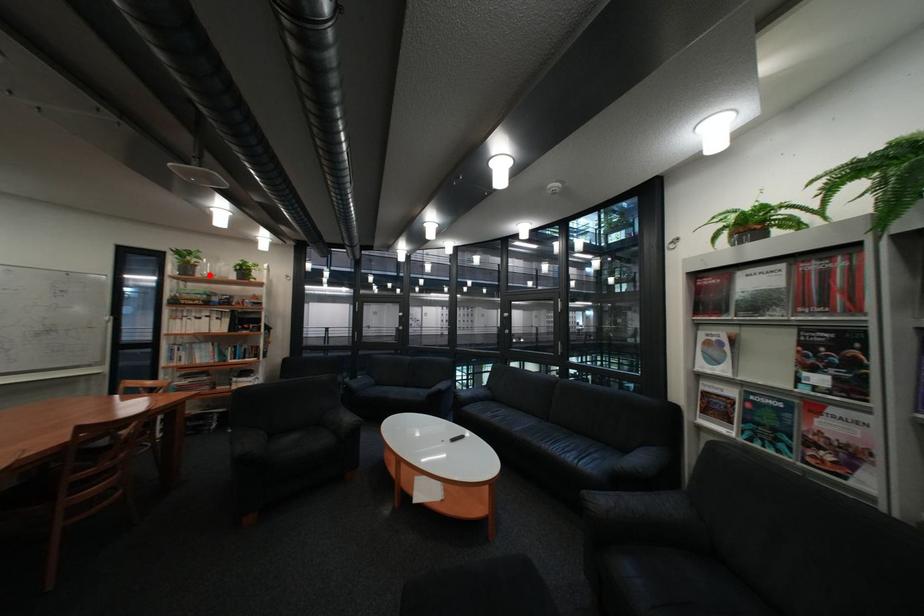
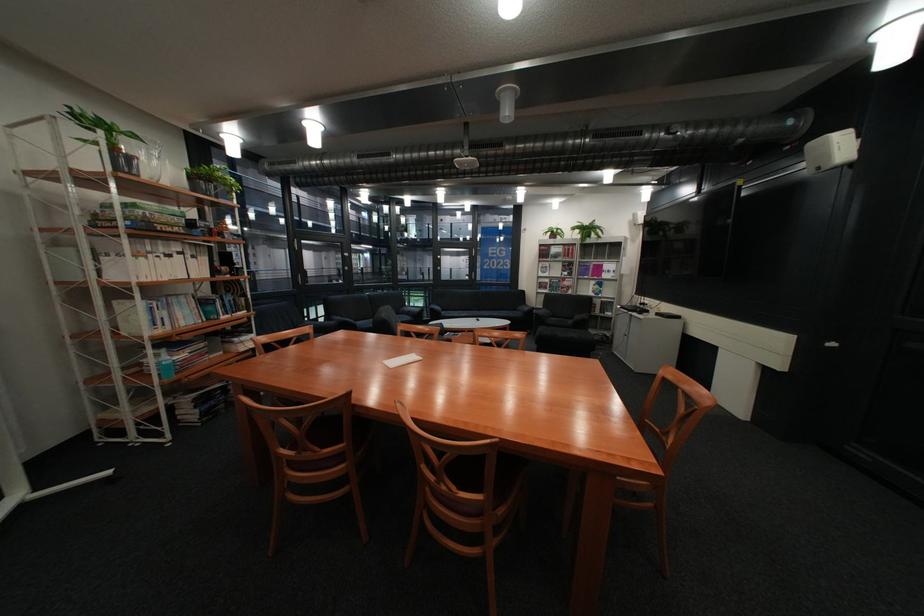
The point at the highlighted location is marked in the first image. Where is the corresponding point in the second image?

(152, 177)